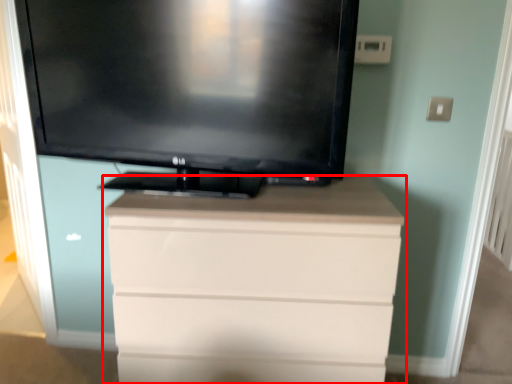
Question: From the image's perspective, where is chest of drawers (annotated by the red box) located relative to television?

Choices:
 (A) below
 (B) above

Answer: (A)